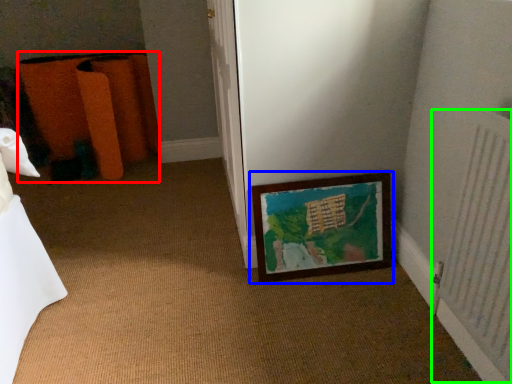
Question: Which is nearer to the furniture (highlighted by a red box)? picture frame (highlighted by a blue box) or radiator (highlighted by a green box).

Choices:
 (A) picture frame
 (B) radiator

Answer: (A)